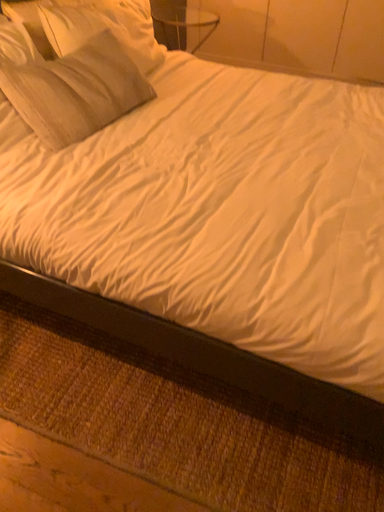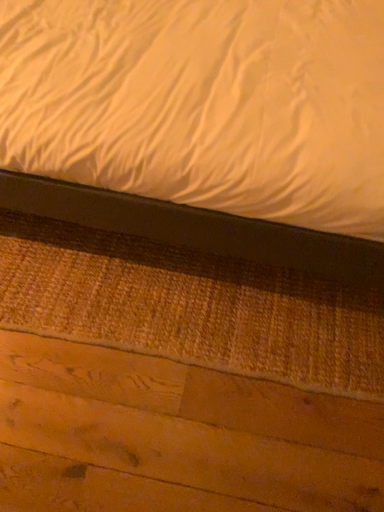
Question: How did the camera likely rotate when shooting the video?

Choices:
 (A) rotated right
 (B) rotated left

Answer: (A)